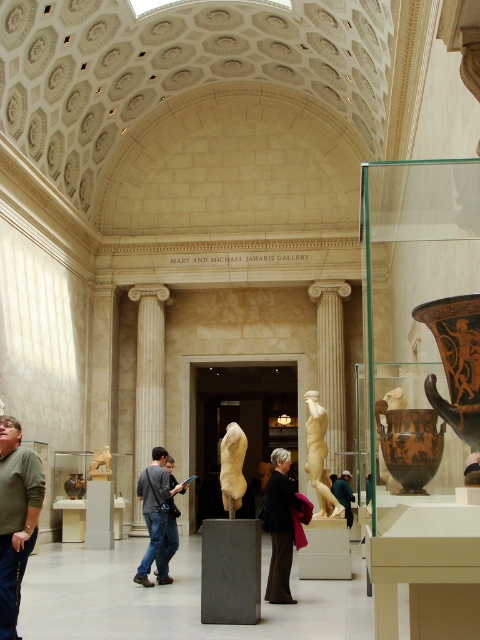
You are an art curator planning to move the brown glossy vase at right and the matte white statue at center to a new exhibition space. The new space has a narrow shelf that can only accommodate one of them. Which object should you place on the shelf to ensure it fits?

The brown glossy vase at right is thinner than the matte white statue at center, so it should be placed on the narrow shelf to ensure it fits.

You are a visitor in the museum and want to take a photo of the dark blue jeans at center without the white marble column at center blocking the view. Is it possible to position yourself in a way that the column is not in the frame?

The white marble column at center is wider than the dark blue jeans at center, so if you position yourself to the side of the column, you can frame the jeans without the column obstructing the view.

You are a security guard in the Mary and Michael Jaharis Gallery. You notice a dark brown leather jacket at center and dark blue jeans at center. Your task is to ensure that all personal items are kept at least 50 feet away from the exhibits. Are the jacket and jeans positioned safely?

The dark brown leather jacket at center is 46.64 feet from dark blue jeans at center, which is less than the required 50 feet distance. Therefore, the jacket and jeans are not positioned safely and need to be moved further apart to comply with the gallery rules.